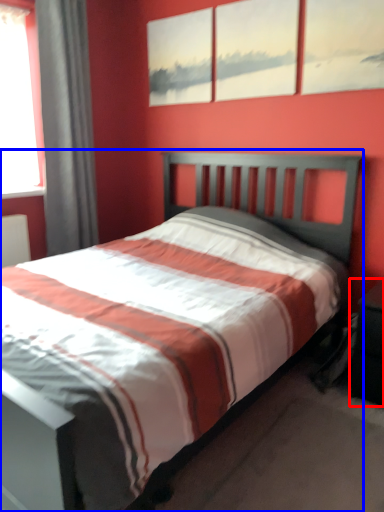
Question: Which point is closer to the camera, nightstand (highlighted by a red box) or bed (highlighted by a blue box)?

Choices:
 (A) nightstand
 (B) bed

Answer: (B)